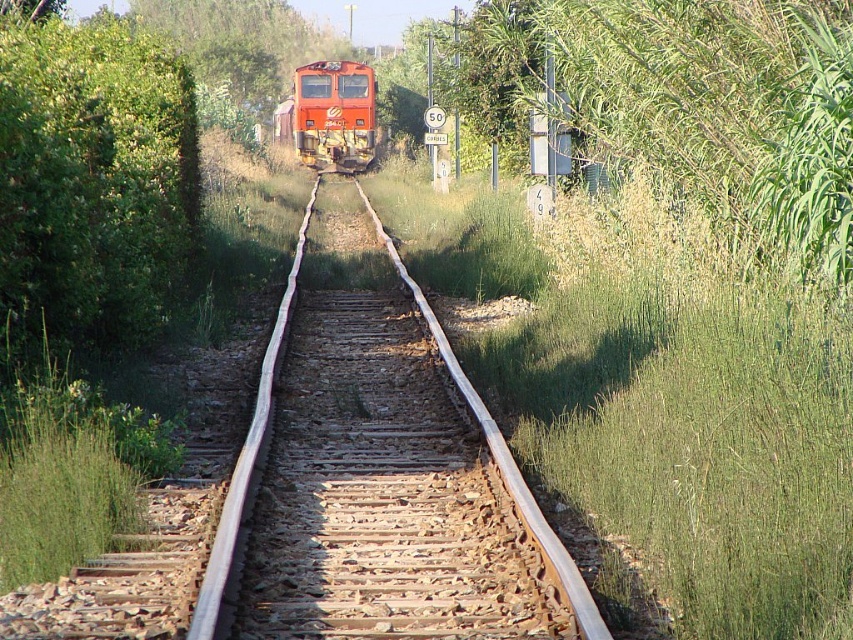
Question: Does green leafy bush at left appear under green leafy tree at upper center?

Choices:
 (A) yes
 (B) no

Answer: (A)

Question: Which point is farther to the camera?

Choices:
 (A) (201, 45)
 (B) (180, 227)

Answer: (A)

Question: Does rusty metal track at center come in front of green leafy bush at left?

Choices:
 (A) no
 (B) yes

Answer: (B)

Question: Which point is closer to the camera?

Choices:
 (A) (300, 161)
 (B) (3, 16)

Answer: (B)

Question: Among these points, which one is farthest from the camera?

Choices:
 (A) (171, 236)
 (B) (439, 506)
 (C) (345, 54)
 (D) (305, 67)

Answer: (C)

Question: Can you confirm if green leafy bush at left is thinner than matte orange train at center?

Choices:
 (A) yes
 (B) no

Answer: (A)